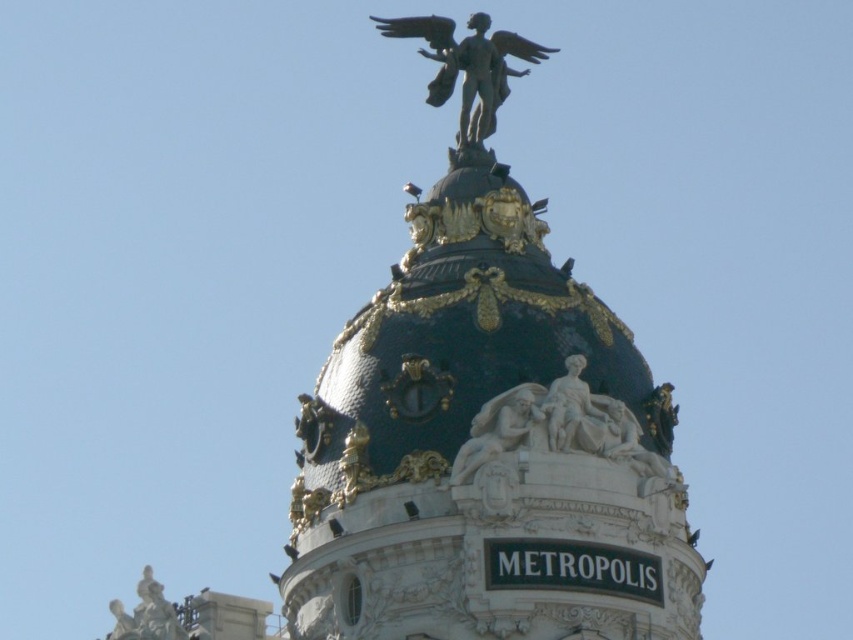
Question: Which point appears closest to the camera in this image?

Choices:
 (A) (560, 392)
 (B) (138, 608)
 (C) (465, 84)

Answer: (A)

Question: Estimate the real-world distances between objects in this image. Which object is farther from the polished bronze statue at upper center?

Choices:
 (A) bronze statue at lower left
 (B) white marble statue at center

Answer: (A)

Question: Is white marble statue at center above bronze statue at lower left?

Choices:
 (A) no
 (B) yes

Answer: (B)

Question: Does white marble statue at center appear on the left side of bronze statue at lower left?

Choices:
 (A) no
 (B) yes

Answer: (A)

Question: Which object is the closest to the white marble statue at center?

Choices:
 (A) polished bronze statue at upper center
 (B) bronze statue at lower left

Answer: (A)

Question: Does polished bronze statue at upper center appear over white marble statue at center?

Choices:
 (A) no
 (B) yes

Answer: (B)